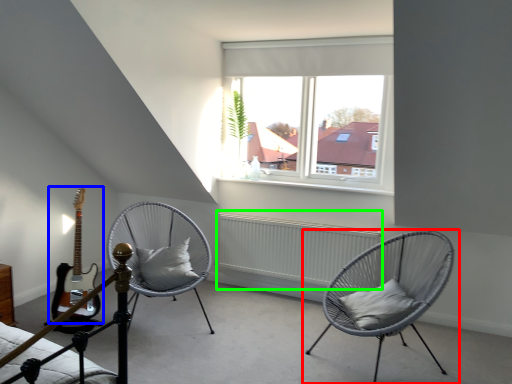
Question: Which object is the farthest from chair (highlighted by a red box)? Choose among these: guitar (highlighted by a blue box) or radiator (highlighted by a green box).

Choices:
 (A) guitar
 (B) radiator

Answer: (A)